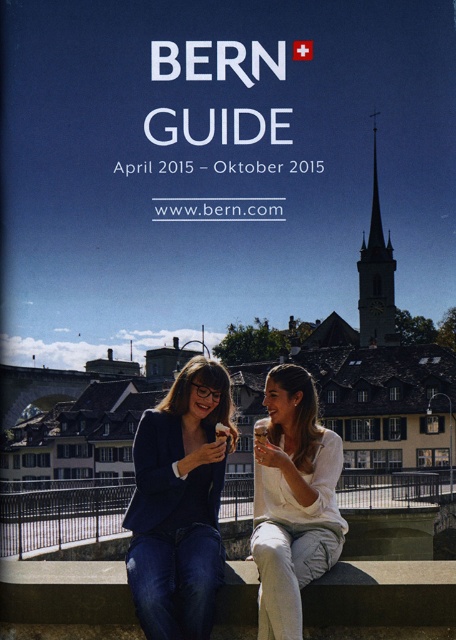
Where is `black concrete ledge at lower center`? black concrete ledge at lower center is located at coordinates (383, 595).

Does point (445, 611) come closer to viewer compared to point (259, 429)?

Yes, it is.

Is point (232, 563) in front of point (258, 428)?

Yes, point (232, 563) is in front of point (258, 428).

Identify the location of black concrete ledge at lower center. The height and width of the screenshot is (640, 456). (383, 595).

Which is more to the right, matte black blazer at center or black concrete ledge at lower center?

black concrete ledge at lower center is more to the right.

Which is below, matte black blazer at center or black concrete ledge at lower center?

black concrete ledge at lower center is lower down.

Find the location of a particular element. matte black blazer at center is located at coordinates (180, 504).

Identify the location of matte black blazer at center. This screenshot has width=456, height=640. (180, 504).

Is point (434, 621) positioned before point (280, 506)?

Yes, it is.

This screenshot has width=456, height=640. Describe the element at coordinates (383, 595) in the screenshot. I see `black concrete ledge at lower center` at that location.

Between point (62, 612) and point (274, 621), which one is positioned behind?

The point (62, 612) is more distant.

Find the location of a particular element. This screenshot has height=640, width=456. black concrete ledge at lower center is located at coordinates (383, 595).